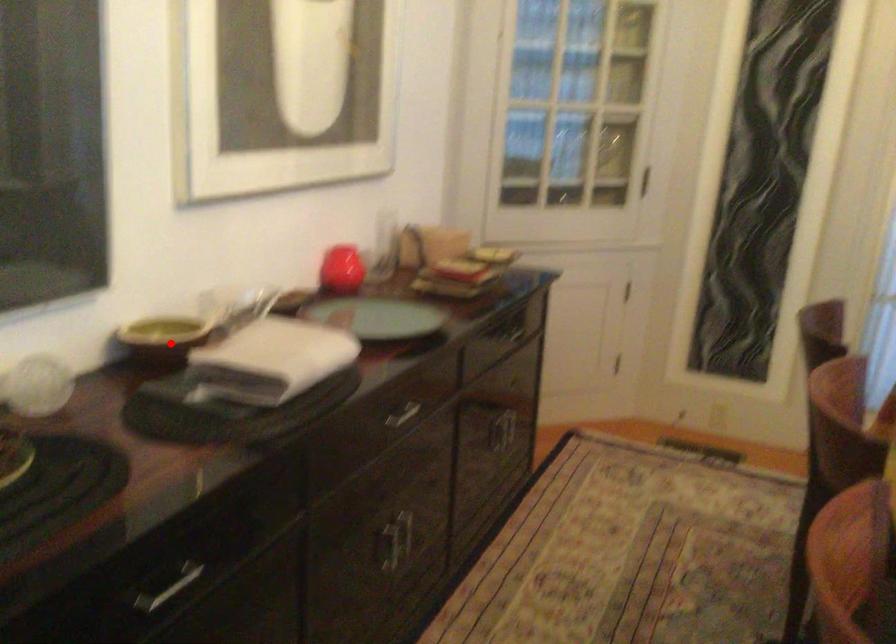
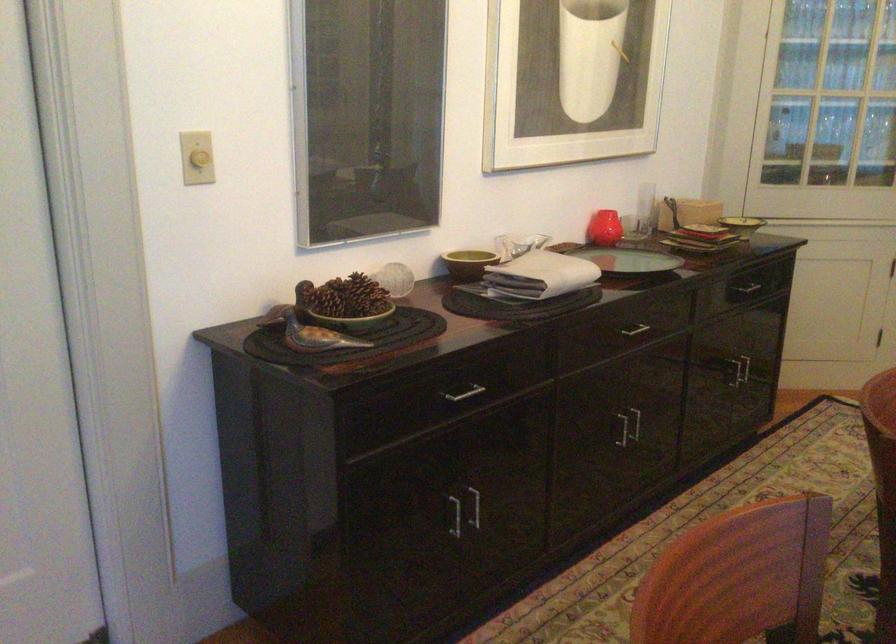
Find the pixel in the second image that matches the highlighted location in the first image.

(468, 263)